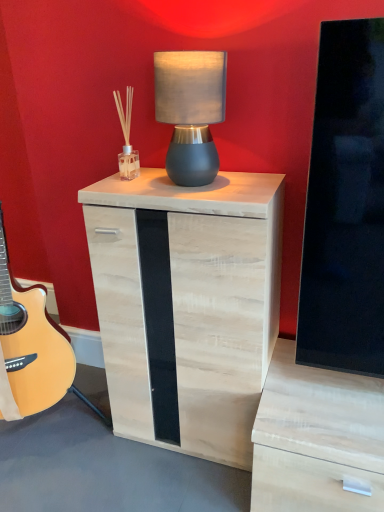
Question: Considering their positions, is matte gray lampshade at center located in front of or behind natural wood nightstand at center?

Choices:
 (A) behind
 (B) front

Answer: (B)

Question: Considering the positions of point (221, 119) and point (251, 354), is point (221, 119) closer or farther from the camera than point (251, 354)?

Choices:
 (A) closer
 (B) farther

Answer: (B)

Question: In the image, is matte gray lampshade at center on the left side or the right side of natural wood nightstand at center?

Choices:
 (A) left
 (B) right

Answer: (B)

Question: Does point (185, 327) appear closer or farther from the camera than point (193, 86)?

Choices:
 (A) farther
 (B) closer

Answer: (A)

Question: Based on their sizes in the image, would you say natural wood nightstand at center is bigger or smaller than matte gray lampshade at center?

Choices:
 (A) small
 (B) big

Answer: (B)

Question: Looking at their shapes, would you say natural wood nightstand at center is wider or thinner than matte gray lampshade at center?

Choices:
 (A) wide
 (B) thin

Answer: (A)

Question: Relative to matte gray lampshade at center, is natural wood nightstand at center in front or behind?

Choices:
 (A) behind
 (B) front

Answer: (A)